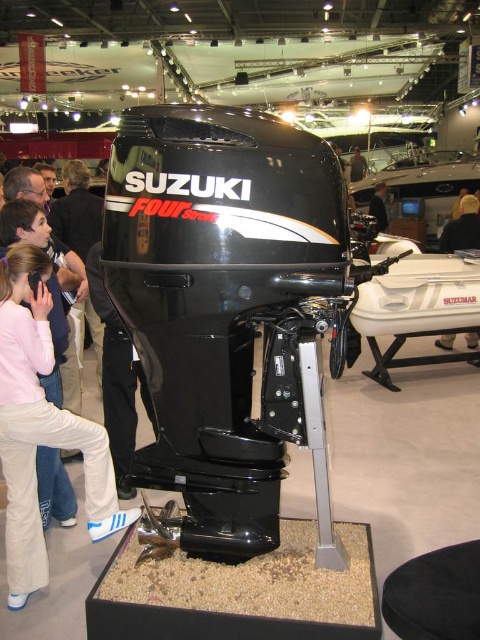
You are at a boat show and see the black plastic outboard motor at center and the light brown leather jacket at center. Which object is closer to the ground?

The black plastic outboard motor at center is positioned under the light brown leather jacket at center, so it is closer to the ground.

You are a photographer at the boat show and want to capture both the black plastic outboard motor at center and the light brown leather jacket at center in the same frame. Since the motor is in front of the jacket, will the jacket be visible in the photo?

The black plastic outboard motor at center is in front of the light brown leather jacket at center, so the jacket will be partially or fully obscured depending on the angle and zoom. Adjust your camera position to ensure both are visible.

You are a photographer standing at the boat show and want to capture a clear photo of the black plastic outboard motor at center. You have a camera with a 50mm lens. Considering the distance between you and the motor, will you be able to fit the entire motor into your photo without zooming in?

The distance between you and the black plastic outboard motor at center is 2.42 meters. With a 50mm lens, this distance should allow the entire motor to fit into the frame without needing to zoom in, assuming standard camera sensor size and composition.